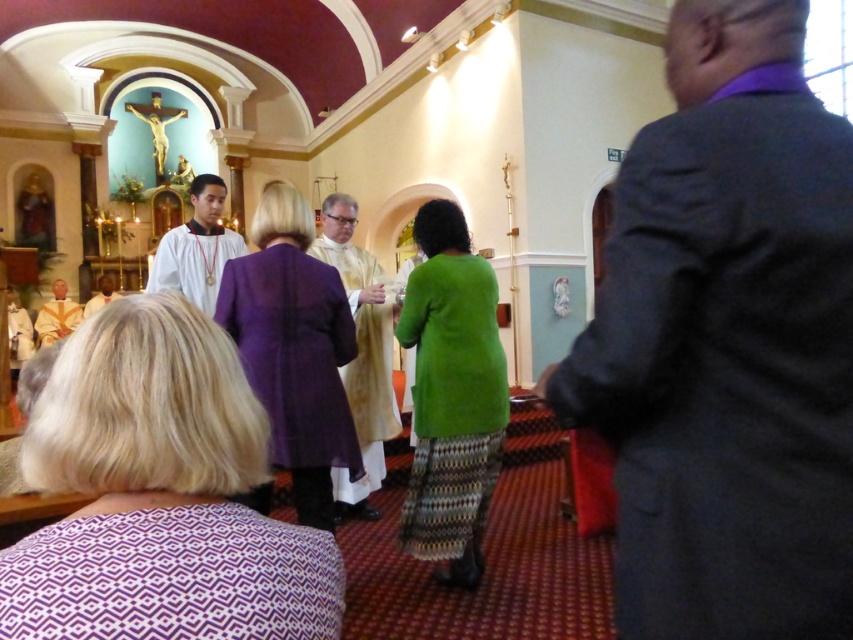
You are attending a religious service and notice two items of clothing near the altar. The purple fabric at lower center and the white satin robe at center. Which one is located to the right of the other?

The purple fabric at lower center is positioned on the right side of white satin robe at center.

You are a photographer positioned at the back of the church. You want to take a photo that includes both the purple sheer dress at center and the white satin robe at center. Given that your camera has a maximum focus range of 7 meters, will you be able to capture both subjects in focus?

The purple sheer dress at center and white satin robe at center are 7.54 meters apart, which exceeds the camera maximum focus range of 7 meters. Therefore, you cannot capture both subjects in focus.